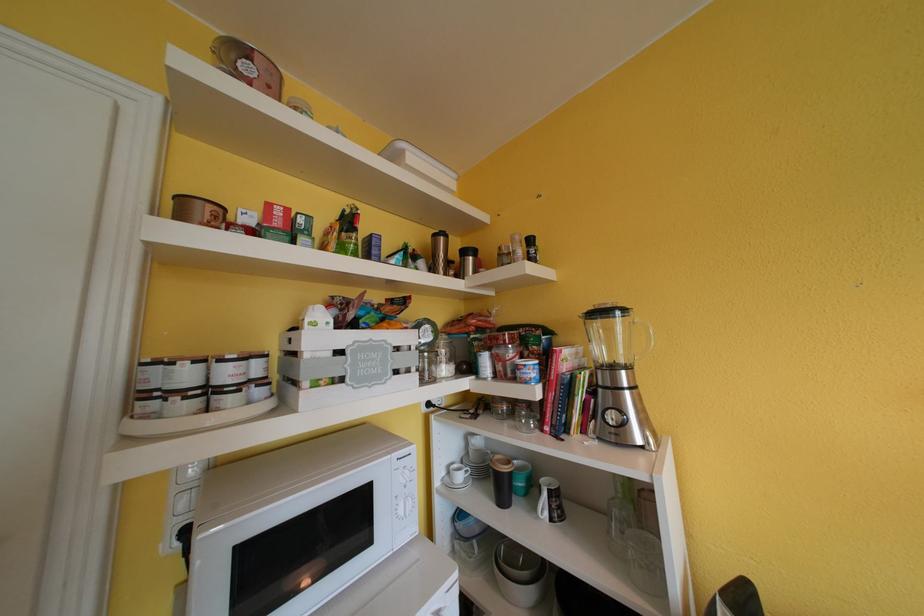
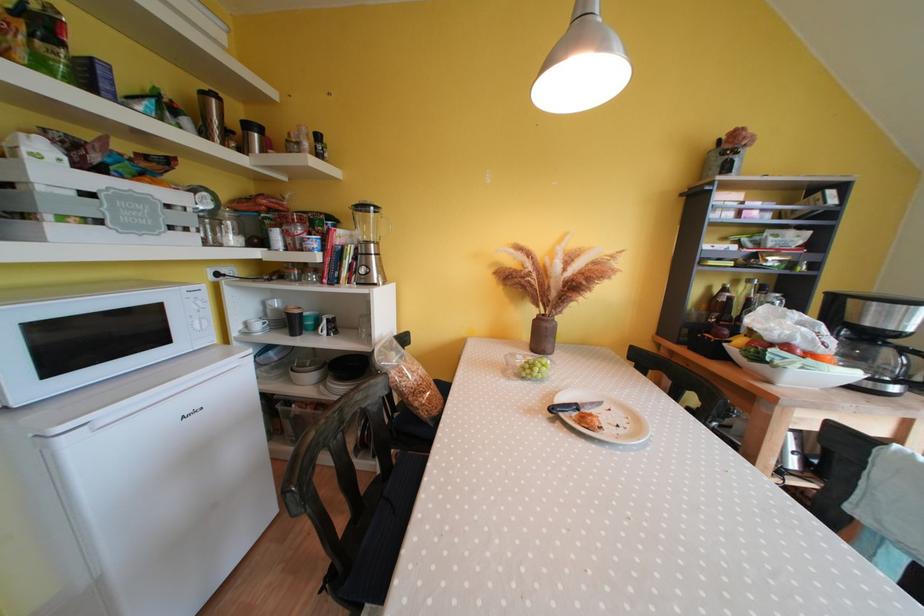
The point at (591,408) is marked in the first image. Where is the corresponding point in the second image?

(357, 269)